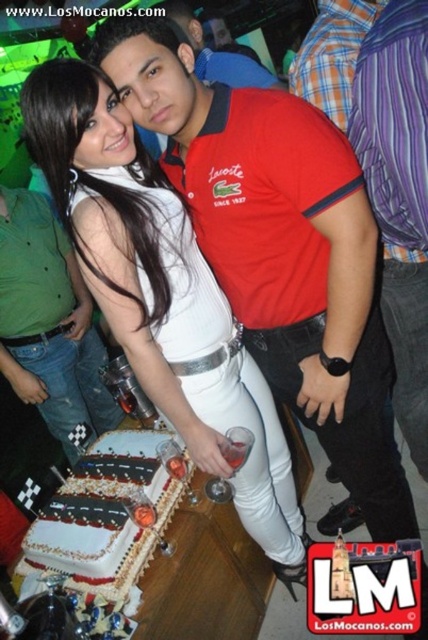
Question: Estimate the real-world distances between objects in this image. Which object is farther from the purple striped shirt at right?

Choices:
 (A) white satin dress at center
 (B) matte red polo shirt at center
 (C) red cotton polo shirt at center
 (D) green denim jeans at center

Answer: (D)

Question: Is red cotton polo shirt at center to the right of green denim jeans at center from the viewer's perspective?

Choices:
 (A) no
 (B) yes

Answer: (B)

Question: Can you confirm if white fondant cake at center is wider than matte red polo shirt at center?

Choices:
 (A) yes
 (B) no

Answer: (B)

Question: Which point is closer to the camera?

Choices:
 (A) green denim jeans at center
 (B) matte red polo shirt at center
 (C) white satin dress at center
 (D) red cotton polo shirt at center

Answer: (D)

Question: Is red cotton polo shirt at center positioned before purple striped shirt at right?

Choices:
 (A) no
 (B) yes

Answer: (A)

Question: Which point is farther from the camera taking this photo?

Choices:
 (A) (92, 360)
 (B) (341, 132)
 (C) (196, 44)
 (D) (385, 260)

Answer: (A)